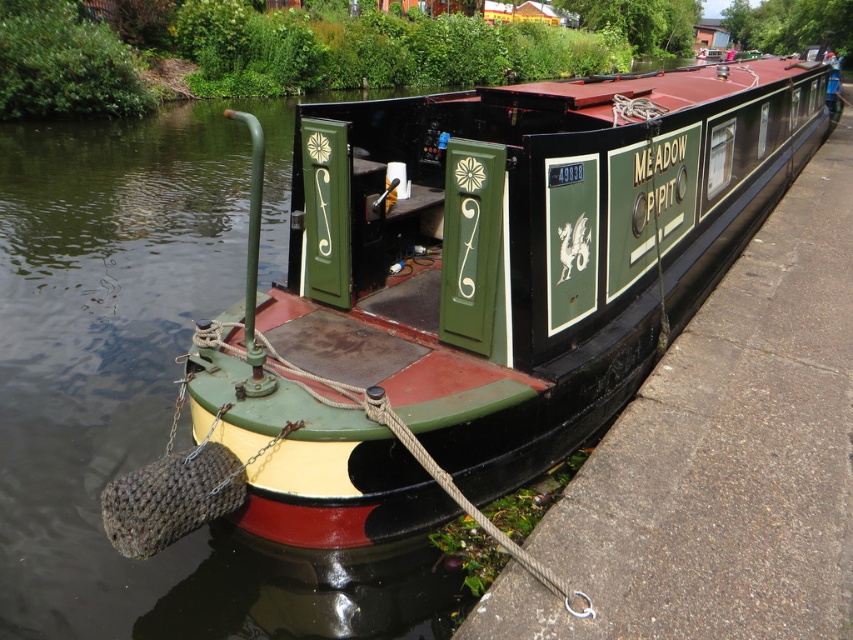
You are navigating a narrowboat and need to determine its position relative to the dock. According to the coordinates provided, where exactly is the green polished wood boat at center positioned?

The green polished wood boat at center is located at point coordinates of (525, 244).

You are standing on the dock next to the narrowboat. You see the point at coordinates (525, 244). What object does this point correspond to?

The point at coordinates (525, 244) corresponds to the green polished wood boat at center.

You are a dock attendant who needs to ensure that the green polished wood boat at center and the green painted wood narrowboat at center can both fit side by side in a docking area that is 10 meters wide. Based on their widths, will they fit together?

The green polished wood boat at center is wider than the green painted wood narrowboat at center. However, without knowing their exact widths, it is impossible to determine if their combined width is less than or equal to 10 meters. Additional information about their individual widths is required to make this assessment.